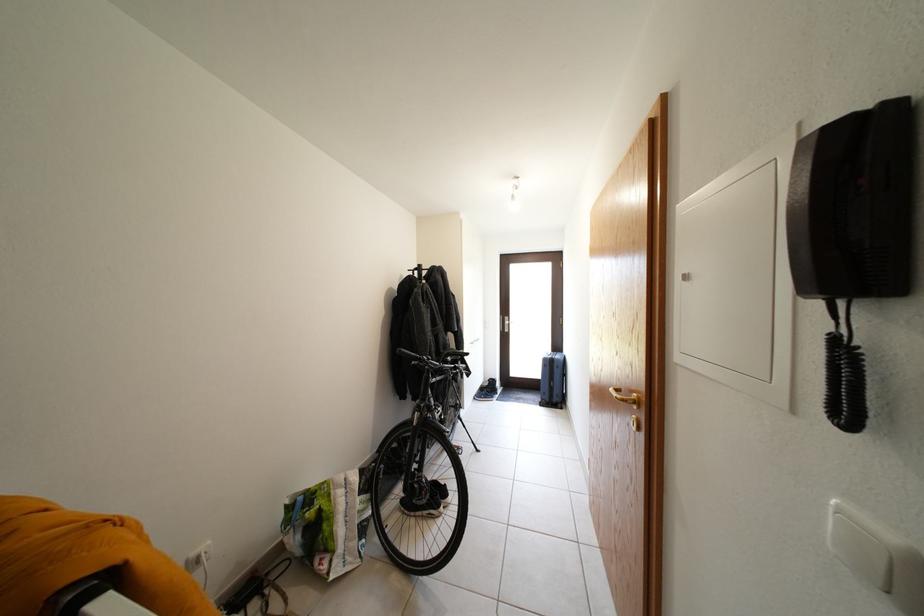
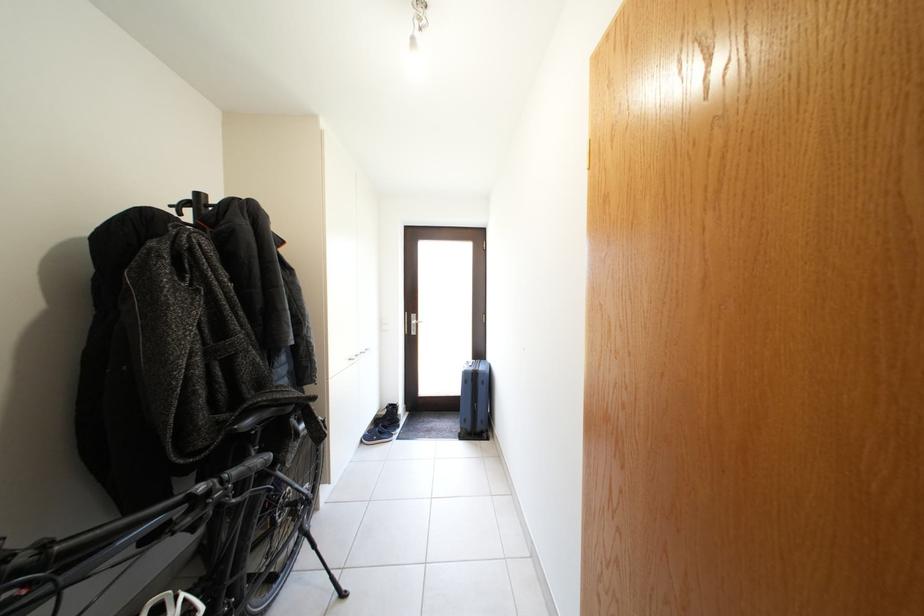
Where in the second image is the point corresponding to [495,397] from the first image?

(392, 431)